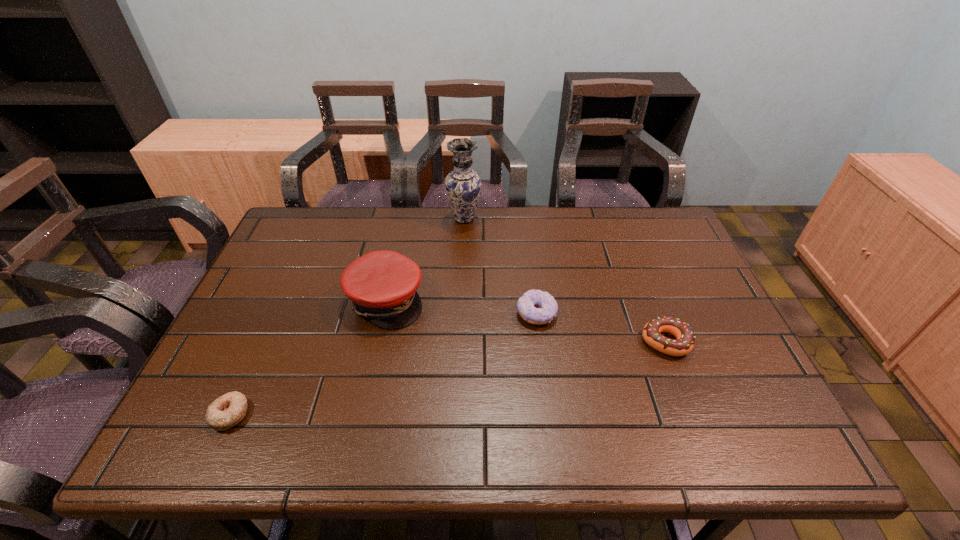
Where is `empty location between the rightmost doughnut and the second doughnut from right to left`? Image resolution: width=960 pixels, height=540 pixels. empty location between the rightmost doughnut and the second doughnut from right to left is located at coordinates pyautogui.click(x=601, y=328).

At what (x,y) coordinates should I click in order to perform the action: click on vacant space that is in between the farthest object and the second object from left to right. Please return your answer as a coordinate pair (x, y). Image resolution: width=960 pixels, height=540 pixels. Looking at the image, I should click on (425, 260).

Where is `free space between the second doughnut from right to left and the nearest object`? free space between the second doughnut from right to left and the nearest object is located at coordinates (383, 364).

What are the coordinates of `free spot between the rightmost object and the third object from right to left` in the screenshot? It's located at (564, 280).

Where is `the fourth closest object relative to the second tallest object`? Image resolution: width=960 pixels, height=540 pixels. the fourth closest object relative to the second tallest object is located at coordinates coord(683,344).

Identify which object is located as the fourth nearest to the third object from left to right. Please provide its 2D coordinates. Your answer should be formatted as a tuple, i.e. [(x, y)], where the tuple contains the x and y coordinates of a point satisfying the conditions above.

[(228, 410)]

Find the location of `doughnut that is the third closest to the second tallest object`. doughnut that is the third closest to the second tallest object is located at coordinates (683, 344).

Locate which doughnut ranks in proximity to the fourth shortest object. Please provide its 2D coordinates. Your answer should be formatted as a tuple, i.e. [(x, y)], where the tuple contains the x and y coordinates of a point satisfying the conditions above.

[(228, 410)]

Where is `free space that satisfies the following two spatial constraints: 1. on the front-facing side of the cap; 2. on the left side of the rightmost doughnut`? This screenshot has height=540, width=960. free space that satisfies the following two spatial constraints: 1. on the front-facing side of the cap; 2. on the left side of the rightmost doughnut is located at coordinates (376, 342).

Where is `vacant space that satisfies the following two spatial constraints: 1. on the front-facing side of the cap; 2. on the right side of the rightmost doughnut`? Image resolution: width=960 pixels, height=540 pixels. vacant space that satisfies the following two spatial constraints: 1. on the front-facing side of the cap; 2. on the right side of the rightmost doughnut is located at coordinates (376, 342).